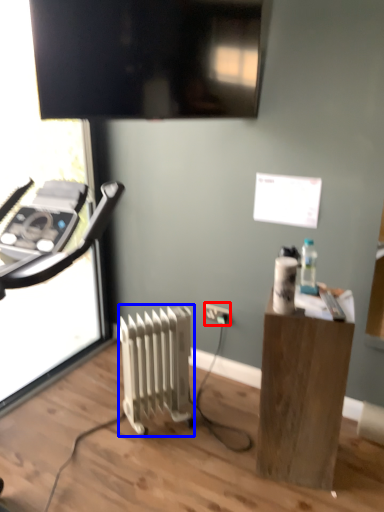
Question: Among these objects, which one is nearest to the camera, electric outlet (highlighted by a red box) or radiator (highlighted by a blue box)?

Choices:
 (A) electric outlet
 (B) radiator

Answer: (B)